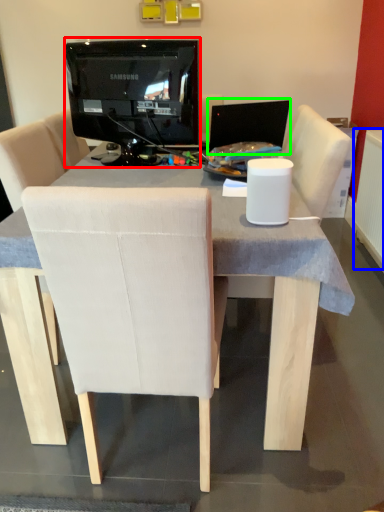
Question: Estimate the real-world distances between objects in this image. Which object is closer to television (highlighted by a red box), radiator (highlighted by a blue box) or computer monitor (highlighted by a green box)?

Choices:
 (A) radiator
 (B) computer monitor

Answer: (B)